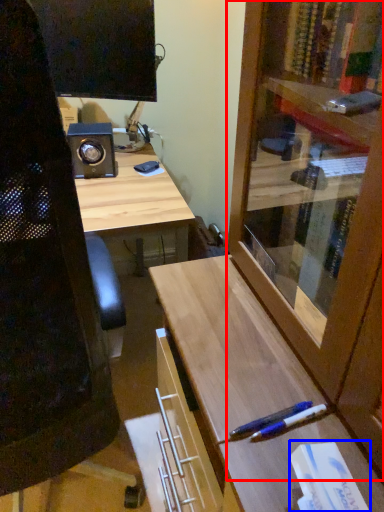
Question: Among these objects, which one is nearest to the camera, cabinetry (highlighted by a red box) or book (highlighted by a blue box)?

Choices:
 (A) cabinetry
 (B) book

Answer: (A)